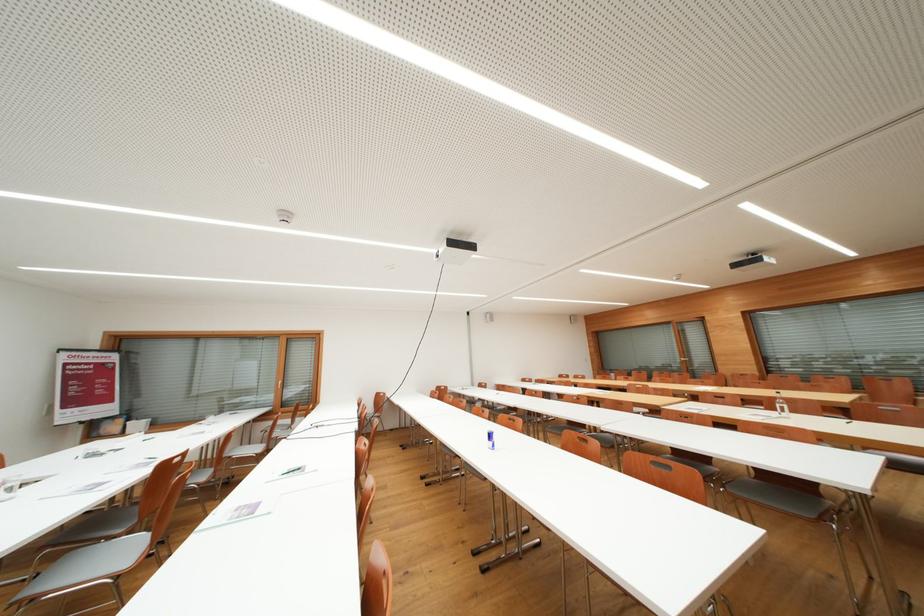
The location [781,405] corresponds to which object?

This point indicates the glass water bottle.